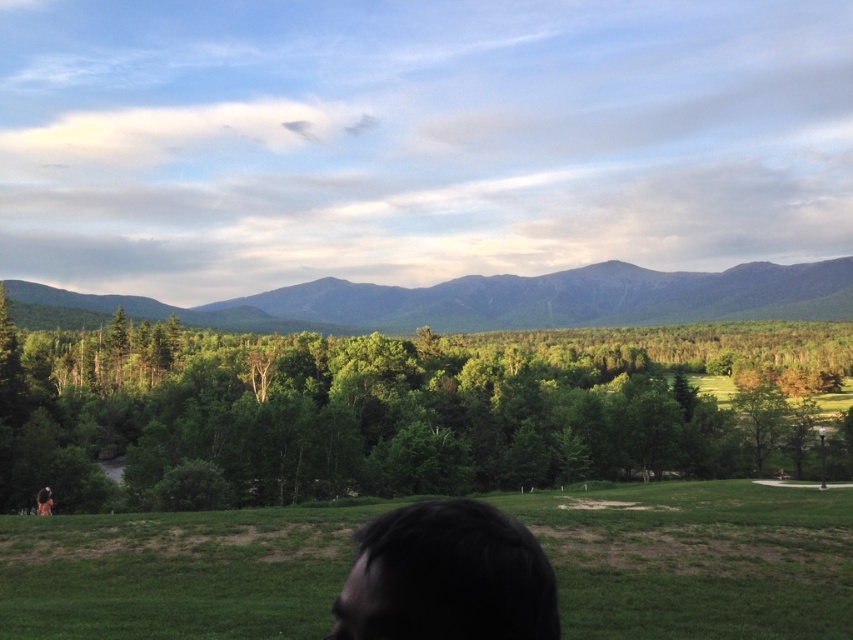
Question: Which of the following is the farthest from the observer?

Choices:
 (A) click(x=236, y=596)
 (B) click(x=51, y=502)

Answer: (B)

Question: Does green leafy trees at center have a greater width compared to green grassy field at lower center?

Choices:
 (A) no
 (B) yes

Answer: (B)

Question: Is green leafy trees at center smaller than green grassy field at lower center?

Choices:
 (A) yes
 (B) no

Answer: (B)

Question: Does green leafy trees at center have a lesser width compared to green textured mountain at upper center?

Choices:
 (A) yes
 (B) no

Answer: (A)

Question: Among these points, which one is farthest from the camera?

Choices:
 (A) (599, 289)
 (B) (47, 515)
 (C) (640, 390)

Answer: (A)

Question: Among these objects, which one is nearest to the camera?

Choices:
 (A) green grassy field at lower center
 (B) green textured mountain at upper center

Answer: (A)